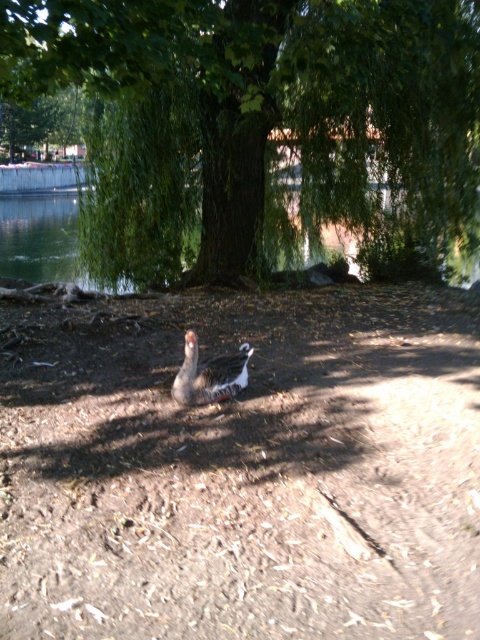
Question: Is green leafy tree at center thinner than green leafy water at center?

Choices:
 (A) yes
 (B) no

Answer: (A)

Question: Among these objects, which one is nearest to the camera?

Choices:
 (A) green leafy tree at center
 (B) speckled gray duck at center

Answer: (B)

Question: In this image, where is green leafy water at center located relative to speckled gray duck at center?

Choices:
 (A) above
 (B) below

Answer: (A)

Question: Is the position of green leafy tree at center less distant than that of green leafy water at center?

Choices:
 (A) no
 (B) yes

Answer: (B)

Question: Which object is farther from the camera taking this photo?

Choices:
 (A) green leafy water at center
 (B) speckled gray duck at center
 (C) green leafy tree at center

Answer: (A)

Question: Among these objects, which one is farthest from the camera?

Choices:
 (A) speckled gray duck at center
 (B) green leafy tree at center
 (C) green leafy water at center

Answer: (C)